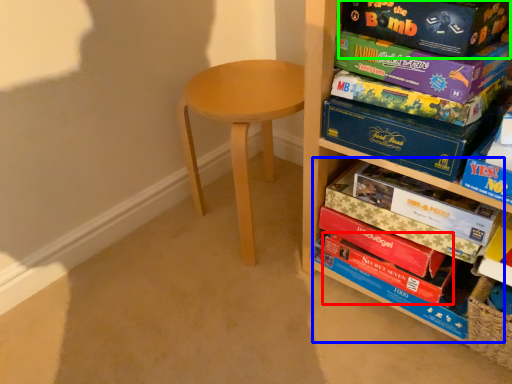
Question: Which is nearer to the paperback book (highlighted by a red box)? book (highlighted by a blue box) or paperback book (highlighted by a green box).

Choices:
 (A) book
 (B) paperback book

Answer: (A)